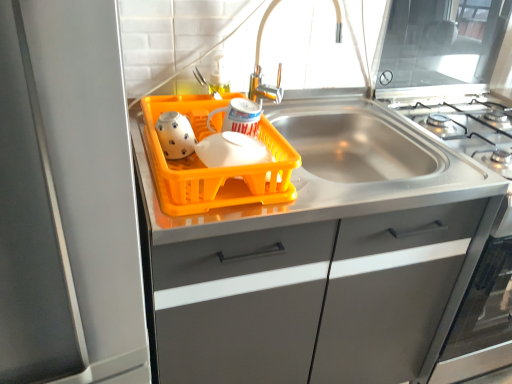
Question: Is matte gray cabinet at center to the right of orange plastic basket at center from the viewer's perspective?

Choices:
 (A) no
 (B) yes

Answer: (B)

Question: Does matte gray cabinet at center have a lesser width compared to orange plastic basket at center?

Choices:
 (A) yes
 (B) no

Answer: (B)

Question: Can you confirm if matte gray cabinet at center is wider than orange plastic basket at center?

Choices:
 (A) yes
 (B) no

Answer: (A)

Question: Considering the relative positions of matte gray cabinet at center and orange plastic basket at center in the image provided, is matte gray cabinet at center in front of orange plastic basket at center?

Choices:
 (A) no
 (B) yes

Answer: (A)

Question: Does matte gray cabinet at center have a larger size compared to orange plastic basket at center?

Choices:
 (A) no
 (B) yes

Answer: (B)

Question: From a real-world perspective, is matte gray cabinet at center under orange plastic basket at center?

Choices:
 (A) yes
 (B) no

Answer: (A)

Question: Does orange plastic basket at center have a lesser width compared to white glossy tea pot at center, the second tea pot in the left-to-right sequence?

Choices:
 (A) no
 (B) yes

Answer: (A)

Question: Is orange plastic basket at center further to camera compared to white glossy tea pot at center, which ranks as the 1th tea pot in right-to-left order?

Choices:
 (A) yes
 (B) no

Answer: (B)

Question: Does orange plastic basket at center have a smaller size compared to white glossy tea pot at center, the second tea pot in the left-to-right sequence?

Choices:
 (A) yes
 (B) no

Answer: (B)

Question: Is orange plastic basket at center facing away from white glossy tea pot at center, the second tea pot in the left-to-right sequence?

Choices:
 (A) no
 (B) yes

Answer: (A)

Question: Considering the relative sizes of orange plastic basket at center and white glossy tea pot at center, the second tea pot in the left-to-right sequence, in the image provided, is orange plastic basket at center bigger than white glossy tea pot at center, the second tea pot in the left-to-right sequence,?

Choices:
 (A) yes
 (B) no

Answer: (A)

Question: Is orange plastic basket at center located outside white glossy tea pot at center, the second tea pot in the left-to-right sequence?

Choices:
 (A) no
 (B) yes

Answer: (B)

Question: From a real-world perspective, is white glossy tea pot at left, which is counted as the second tea pot, starting from the right, under orange plastic basket at center?

Choices:
 (A) yes
 (B) no

Answer: (B)